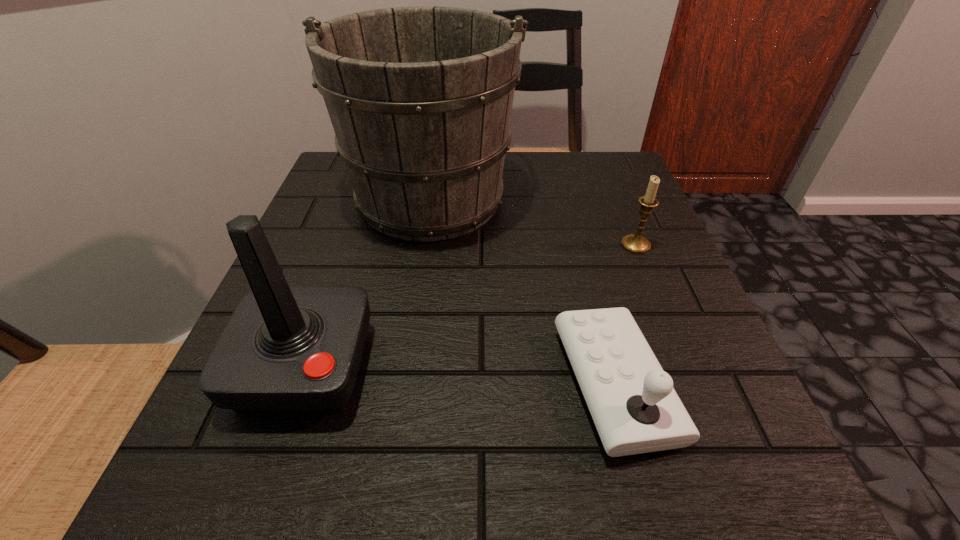
Identify the location of the tallest object. (420, 98).

This screenshot has width=960, height=540. Identify the location of the left joystick. (x=286, y=349).

You are a GUI agent. You are given a task and a screenshot of the screen. Output one action in this format:
    pyautogui.click(x=<x>, y=<y>)
    Task: Click on the taller joystick
    Image resolution: width=960 pixels, height=540 pixels.
    Given the screenshot: What is the action you would take?
    pyautogui.click(x=286, y=349)

Where is `the second shortest object`? the second shortest object is located at coordinates (638, 244).

Find the location of a particular element. the rightmost object is located at coordinates (638, 244).

In order to click on the shorter joystick in this screenshot , I will do `click(631, 399)`.

Locate an element on the screen. the shortest object is located at coordinates (631, 399).

Locate an element on the screen. This screenshot has height=540, width=960. free space located 0.230m on the back of the left joystick is located at coordinates (351, 231).

The image size is (960, 540). Identify the location of vacant space located 0.240m on the left of the third tallest object. (494, 245).

Locate an element on the screen. This screenshot has height=540, width=960. vacant space located on the back of the third object from left to right is located at coordinates (592, 296).